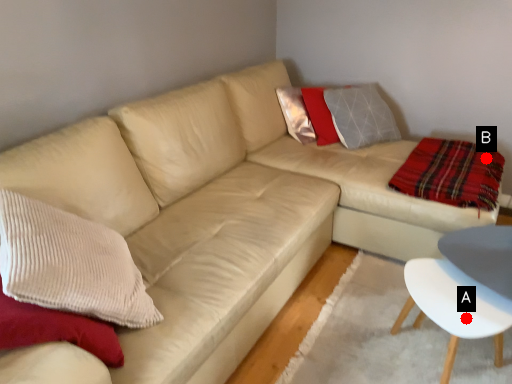
Question: Two points are circled on the image, labeled by A and B beside each circle. Which point is further to the camera?

Choices:
 (A) A is further
 (B) B is further

Answer: (B)